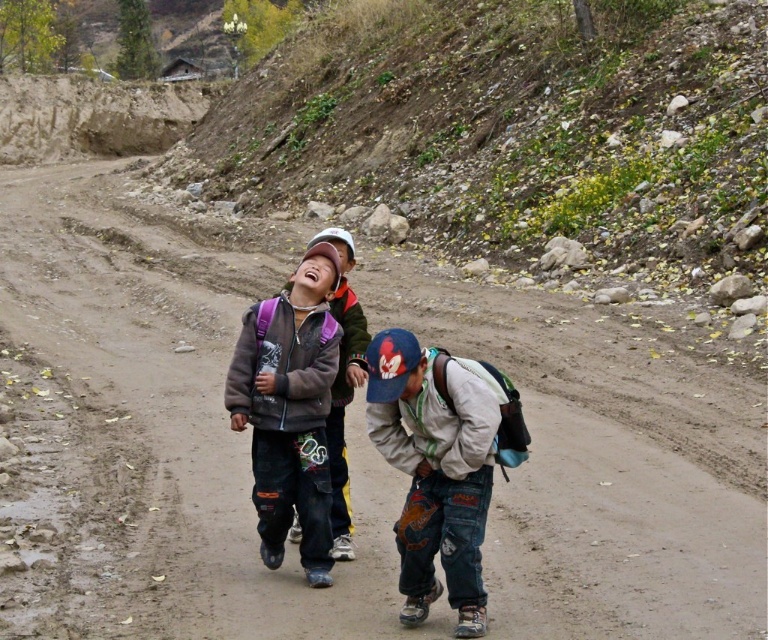
Question: Which of the following is the farthest from the observer?

Choices:
 (A) (250, 497)
 (B) (416, 541)

Answer: (A)

Question: Can you confirm if matte gray jacket at center is bigger than matte blue backpack at center?

Choices:
 (A) no
 (B) yes

Answer: (B)

Question: Does denim pants at center appear over matte blue backpack at center?

Choices:
 (A) yes
 (B) no

Answer: (B)

Question: Which point is farther to the camera?

Choices:
 (A) denim pants at center
 (B) matte gray jacket at center
 (C) matte blue backpack at center

Answer: (B)

Question: Can you confirm if matte gray jacket at center is positioned above matte blue backpack at center?

Choices:
 (A) no
 (B) yes

Answer: (A)

Question: Which object appears closest to the camera in this image?

Choices:
 (A) denim pants at center
 (B) matte gray jacket at center

Answer: (A)